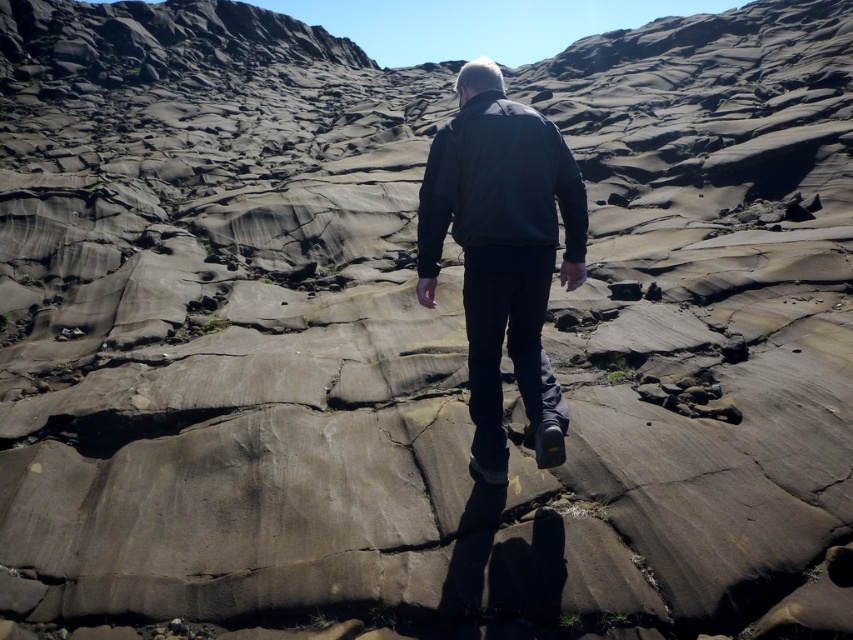
You are a photographer trying to capture the dark gray jacket at center from a specific angle. The camera is positioned at point A, which is located at coordinates 0.395, 0.591. What is the best way to frame the shot to ensure the jacket is the main focus?

Since the dark gray jacket at center is already positioned at point (503, 252), which aligns with the camera position at point A, you can frame the shot by centering the jacket within the viewfinder to make it the main focus.

You are a photographer trying to capture a detailed shot of both the dark gray jacket at center and the dark gray matte jacket at center in the image. Given that your camera can focus on objects within a 10 inch range, will you be able to capture both jackets clearly in a single shot?

The dark gray jacket at center is 10.20 inches from the dark gray matte jacket at center. Since the distance between them exceeds the camera focus range of 10 inches, you might not be able to capture both jackets clearly in a single shot.

You are standing at the origin point in the image. There is a dark gray jacket at center located at point [503,252]. What direction should you move to reach the dark gray jacket at center?

To reach the dark gray jacket at center located at point [503,252] from the origin, you should move towards the point [503,252] which is the direction of the jacket.